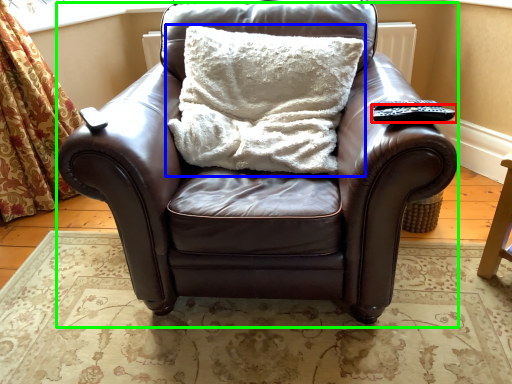
Question: Which object is the closest to the remote (highlighted by a red box)? Choose among these: pillow (highlighted by a blue box) or chair (highlighted by a green box).

Choices:
 (A) pillow
 (B) chair

Answer: (A)